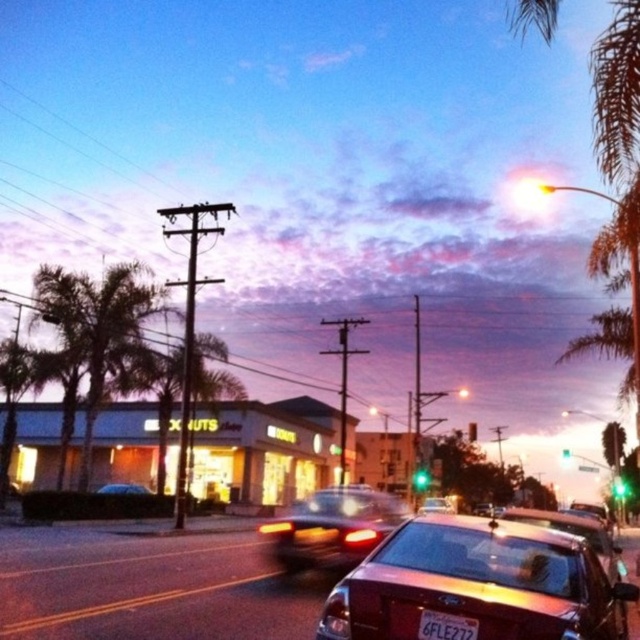
Question: Among these objects, which one is nearest to the camera?

Choices:
 (A) white plastic license plate at center
 (B) green glass traffic light at center
 (C) shiny red sedan at center
 (D) green leafy palm tree at left

Answer: (C)

Question: Where is green leafy palm tree at left located in relation to green leafy palm tree at center in the image?

Choices:
 (A) right
 (B) left

Answer: (B)

Question: Which point is closer to the camera taking this photo?

Choices:
 (A) (289, 538)
 (B) (122, 381)

Answer: (A)

Question: Is metallic silver car at center to the right of white plastic license plate at center from the viewer's perspective?

Choices:
 (A) no
 (B) yes

Answer: (A)

Question: Is shiny red sedan at center in front of satin black sedan at center?

Choices:
 (A) yes
 (B) no

Answer: (A)

Question: Which point is farther from the camera taking this photo?

Choices:
 (A) (148, 305)
 (B) (552, 518)
 (C) (472, 621)
 (D) (292, 522)

Answer: (A)